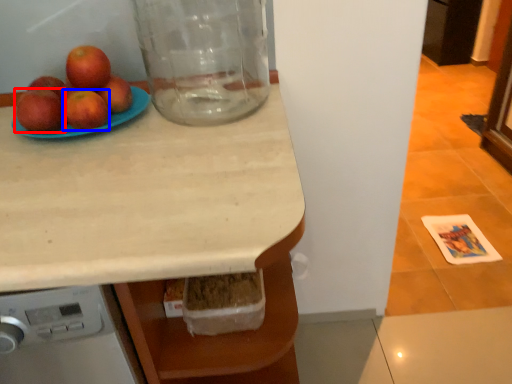
Question: Among these objects, which one is farthest to the camera, apple (highlighted by a red box) or apple (highlighted by a blue box)?

Choices:
 (A) apple
 (B) apple

Answer: (B)